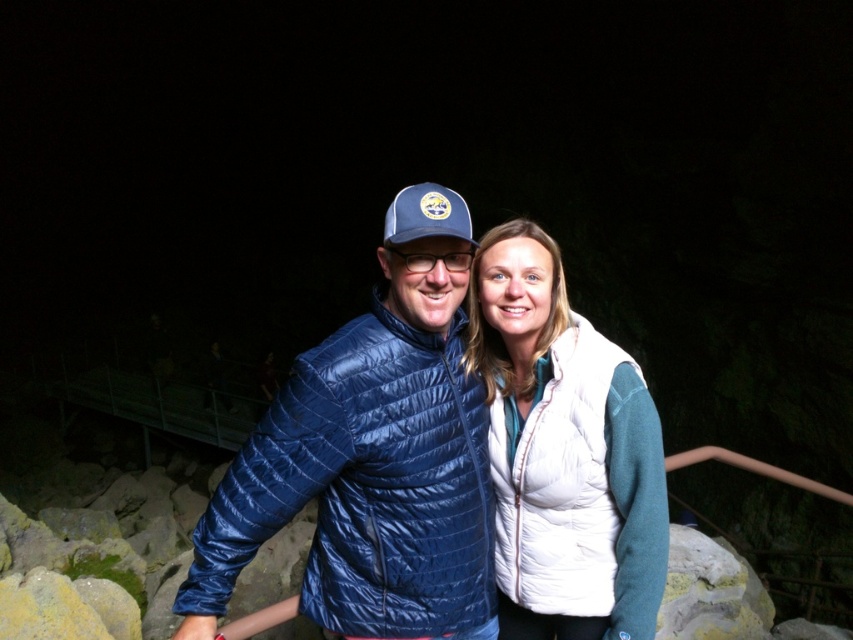
Question: Is matte blue puffer jacket at center smaller than white down vest at center?

Choices:
 (A) no
 (B) yes

Answer: (A)

Question: Which of the following is the closest to the observer?

Choices:
 (A) white down vest at center
 (B) blue fabric baseball cap at center

Answer: (B)

Question: Which object is positioned farthest from the matte blue puffer jacket at center?

Choices:
 (A) blue fabric baseball cap at center
 (B) white down vest at center

Answer: (A)

Question: Is matte blue puffer jacket at center above blue fabric baseball cap at center?

Choices:
 (A) yes
 (B) no

Answer: (B)

Question: Which point is closer to the camera taking this photo?

Choices:
 (A) (386, 214)
 (B) (467, 376)

Answer: (A)

Question: Can you confirm if matte blue puffer jacket at center is positioned below white down vest at center?

Choices:
 (A) yes
 (B) no

Answer: (A)